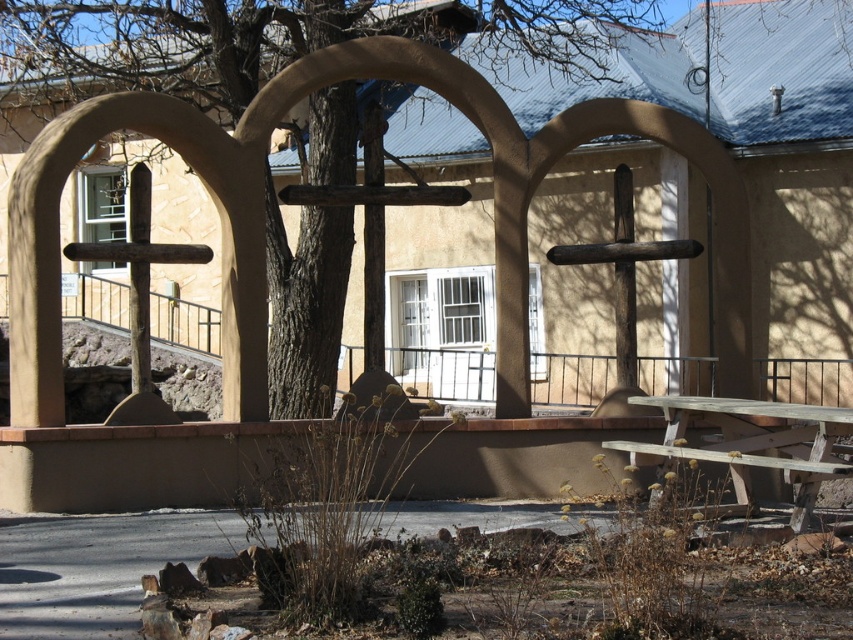
You are planning a picnic and want to set up a table away from the brown rough tree at center. Based on the scene, where should you place the wooden picnic table at lower right to ensure it is not near the tree?

The brown rough tree at center is positioned on the left side of wooden picnic table at lower right, so to place the table away from the tree, you should move it to the right side of the brown rough tree at center.

Consider the image. You are planning to set up a picnic table in the outdoor area shown. Given the scene, can you determine if the brown rough tree at center will block sunlight from reaching the wooden picnic table at lower right?

The brown rough tree at center is above the wooden picnic table at lower right, so it will block sunlight from reaching the table.

You are planning to set up a small garden in the area between the brown rough tree at center and the wooden picnic table at lower right. Considering their sizes, which object would you need to consider more when planning the space?

The wooden picnic table at lower right occupies more space than the brown rough tree at center, so you should consider its size more carefully when planning the garden layout.